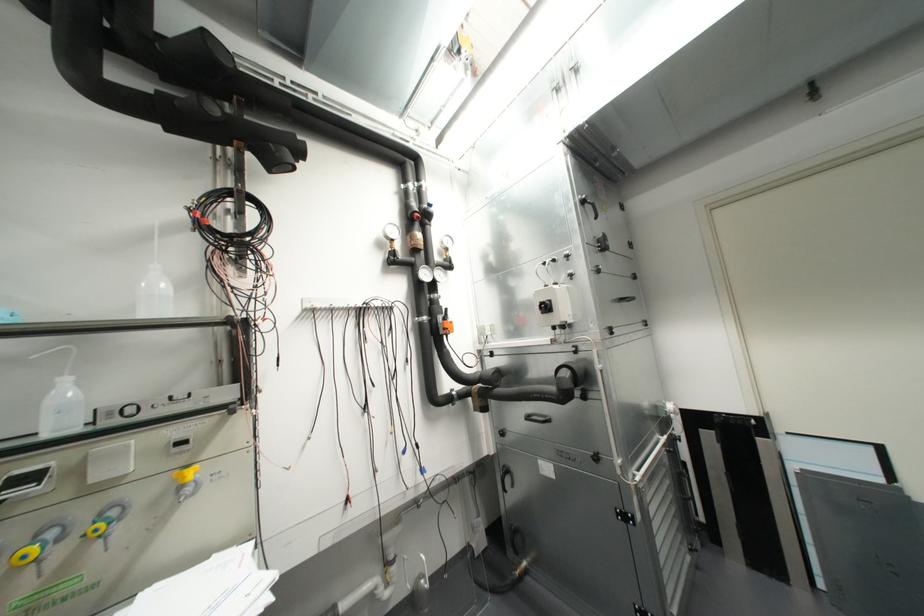
Locate an element on the screen. This screenshot has height=616, width=924. yellow valve handle is located at coordinates (26, 554).